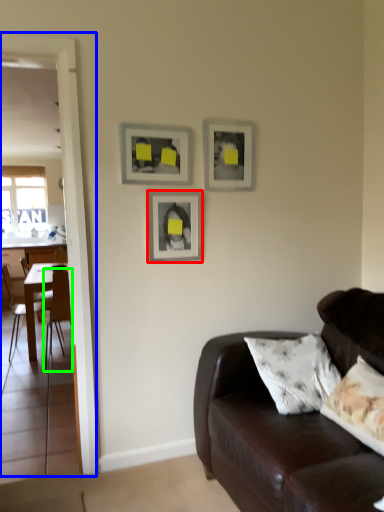
Question: Which object is positioned farthest from picture frame (highlighted by a red box)? Select from glass door (highlighted by a blue box) and chair (highlighted by a green box).

Choices:
 (A) glass door
 (B) chair

Answer: (B)